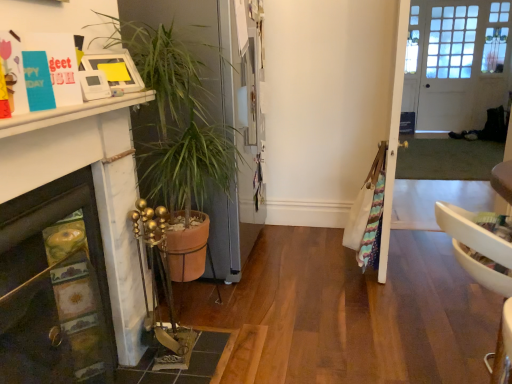
Question: Is terracotta pot at left positioned far away from white wooden door at upper right?

Choices:
 (A) yes
 (B) no

Answer: (A)

Question: Considering the relative positions of terracotta pot at left and white wooden door at upper right in the image provided, is terracotta pot at left to the left of white wooden door at upper right from the viewer's perspective?

Choices:
 (A) no
 (B) yes

Answer: (B)

Question: Does terracotta pot at left lie in front of white wooden door at upper right?

Choices:
 (A) no
 (B) yes

Answer: (B)

Question: Is terracotta pot at left further to the viewer compared to white wooden door at upper right?

Choices:
 (A) no
 (B) yes

Answer: (A)

Question: Is terracotta pot at left taller than white wooden door at upper right?

Choices:
 (A) yes
 (B) no

Answer: (B)

Question: Does terracotta pot at left have a greater width compared to white wooden door at upper right?

Choices:
 (A) yes
 (B) no

Answer: (A)

Question: Does marble fireplace at lower left have a lesser width compared to white wooden door at upper right?

Choices:
 (A) no
 (B) yes

Answer: (A)

Question: Can you confirm if marble fireplace at lower left is shorter than white wooden door at upper right?

Choices:
 (A) yes
 (B) no

Answer: (A)

Question: Does marble fireplace at lower left have a greater height compared to white wooden door at upper right?

Choices:
 (A) no
 (B) yes

Answer: (A)

Question: Are marble fireplace at lower left and white wooden door at upper right making contact?

Choices:
 (A) yes
 (B) no

Answer: (B)

Question: Is marble fireplace at lower left oriented towards white wooden door at upper right?

Choices:
 (A) no
 (B) yes

Answer: (A)

Question: Is marble fireplace at lower left to the right of white wooden door at upper right from the viewer's perspective?

Choices:
 (A) yes
 (B) no

Answer: (B)

Question: Is white wooden door at upper right touching clear glass door at center?

Choices:
 (A) yes
 (B) no

Answer: (A)